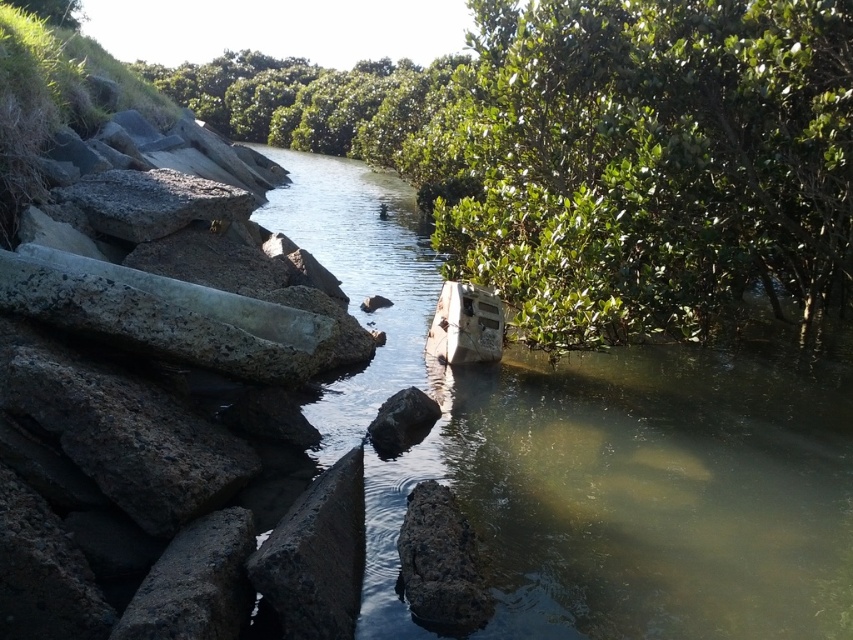
Which is in front, point (242, 448) or point (405, 394)?

Point (242, 448) is more forward.

Describe the element at coordinates (125, 435) in the screenshot. I see `dark gray concrete at left` at that location.

Where is `dark gray concrete at left`? This screenshot has height=640, width=853. dark gray concrete at left is located at coordinates (125, 435).

Between concrete block at center and rusty metal boat at center, which one appears on the left side from the viewer's perspective?

From the viewer's perspective, rusty metal boat at center appears more on the left side.

At what (x,y) coordinates should I click in order to perform the action: click on concrete block at center. Please return your answer as a coordinate pair (x, y). Looking at the image, I should click on (589, 454).

Who is more distant from viewer, (808, 497) or (461, 307)?

Point (461, 307)

You are a GUI agent. You are given a task and a screenshot of the screen. Output one action in this format:
    pyautogui.click(x=<x>, y=<y>)
    Task: Click on the concrete block at center
    This screenshot has width=853, height=640.
    Given the screenshot: What is the action you would take?
    pyautogui.click(x=589, y=454)

Does point (236, 605) lie in front of point (450, 570)?

Yes, point (236, 605) is in front of point (450, 570).

Image resolution: width=853 pixels, height=640 pixels. I want to click on rough concrete rock at left, so click(x=195, y=582).